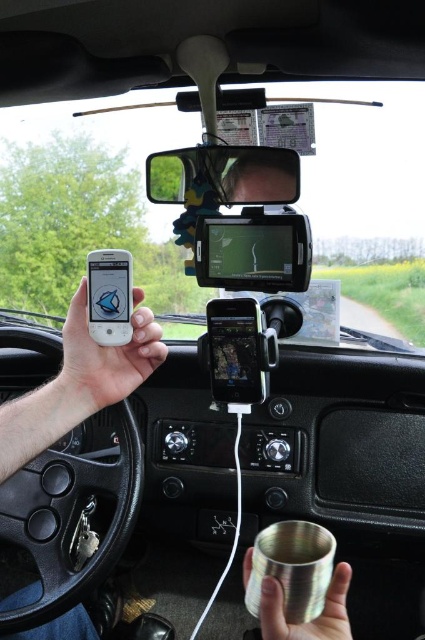
You are driving and need to check both the white matte phone at center left and the metallic cylindrical object in your right hand. How far apart are they?

The white matte phone at center left and the metallic cylindrical object in your right hand are 23.46 inches apart.

You are sitting in the driver seat and looking at the dashboard. There are two points on the dashboard, point (172, 157) and point (263, 620). Which point is closer to you?

Point (172, 157) is further to the camera than point (263, 620), so the point closer to you is point (263, 620).

You are a passenger in the car and want to check the GPS navigation system mounted on the dashboard. Which object, the clear plastic view mirror at upper center or the brushed metal cup at lower center, is closer to the GPS navigation system?

The brushed metal cup at lower center is closer to the GPS navigation system because it is positioned at lower center, which is closer to the dashboard where the GPS is mounted, compared to the clear plastic view mirror at upper center located higher up.